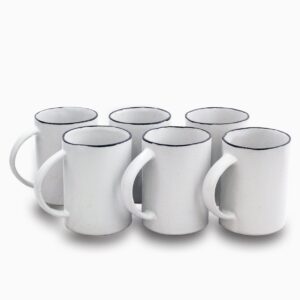
At what (x,y) coordinates should I click in order to perform the action: click on handle. Please return your answer as a coordinate pair (x, y). The image size is (300, 300). Looking at the image, I should click on (6, 161), (37, 184), (124, 184), (206, 187).